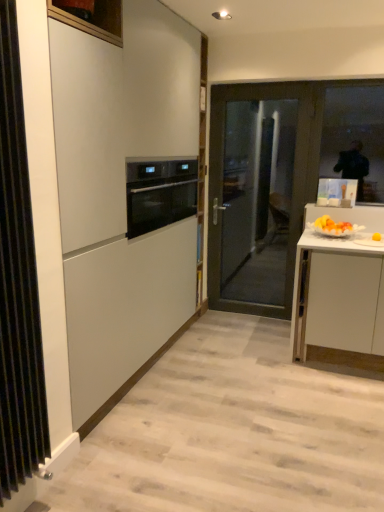
Question: Does point (74, 224) appear closer or farther from the camera than point (11, 415)?

Choices:
 (A) farther
 (B) closer

Answer: (A)

Question: From a real-world perspective, is matte white cabinet at center positioned above or below black metal radiator at left?

Choices:
 (A) below
 (B) above

Answer: (B)

Question: Estimate the real-world distances between objects in this image. Which object is farther from the matte white cabinet at center?

Choices:
 (A) transparent glass window at upper right
 (B) black metal radiator at left
 (C) black glass oven at center
 (D) dark gray glass door at center

Answer: (A)

Question: Which is nearer to the black metal radiator at left?

Choices:
 (A) transparent glass window at upper right
 (B) black glass oven at center
 (C) matte white cabinet at center
 (D) dark gray glass door at center

Answer: (C)